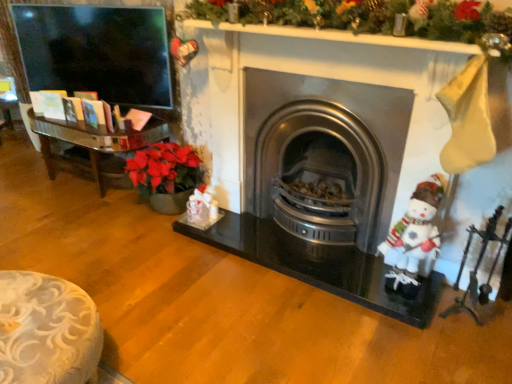
Question: From the image's perspective, does white fabric santa claus at right appear higher than stainless steel wood burning stove at center?

Choices:
 (A) no
 (B) yes

Answer: (A)

Question: Is stainless steel wood burning stove at center located within white fabric santa claus at right?

Choices:
 (A) no
 (B) yes

Answer: (A)

Question: Considering the relative positions of white fabric santa claus at right and stainless steel wood burning stove at center in the image provided, is white fabric santa claus at right to the left of stainless steel wood burning stove at center from the viewer's perspective?

Choices:
 (A) yes
 (B) no

Answer: (B)

Question: Is white fabric santa claus at right looking in the opposite direction of stainless steel wood burning stove at center?

Choices:
 (A) yes
 (B) no

Answer: (B)

Question: Does white fabric santa claus at right have a greater width compared to stainless steel wood burning stove at center?

Choices:
 (A) yes
 (B) no

Answer: (B)

Question: From a real-world perspective, is white fabric santa claus at right above or below metallic silver fireplace tools at right?

Choices:
 (A) above
 (B) below

Answer: (A)

Question: Is white fabric santa claus at right situated inside metallic silver fireplace tools at right or outside?

Choices:
 (A) inside
 (B) outside

Answer: (B)

Question: Relative to metallic silver fireplace tools at right, is white fabric santa claus at right in front or behind?

Choices:
 (A) behind
 (B) front

Answer: (A)

Question: Based on their sizes in the image, would you say white fabric santa claus at right is bigger or smaller than metallic silver fireplace tools at right?

Choices:
 (A) big
 (B) small

Answer: (A)

Question: From the image's perspective, is metallic silver fireplace tools at right above or below white fabric santa claus at right?

Choices:
 (A) above
 (B) below

Answer: (B)

Question: Which is correct: metallic silver fireplace tools at right is inside white fabric santa claus at right, or outside of it?

Choices:
 (A) inside
 (B) outside

Answer: (B)

Question: Based on their positions, is metallic silver fireplace tools at right located to the left or right of white fabric santa claus at right?

Choices:
 (A) left
 (B) right

Answer: (B)

Question: From a real-world perspective, is metallic silver fireplace tools at right physically located above or below white fabric santa claus at right?

Choices:
 (A) above
 (B) below

Answer: (B)

Question: From the image's perspective, relative to white fabric santa claus at right, is stainless steel wood burning stove at center above or below?

Choices:
 (A) below
 (B) above

Answer: (B)

Question: Which is correct: stainless steel wood burning stove at center is inside white fabric santa claus at right, or outside of it?

Choices:
 (A) inside
 (B) outside

Answer: (B)